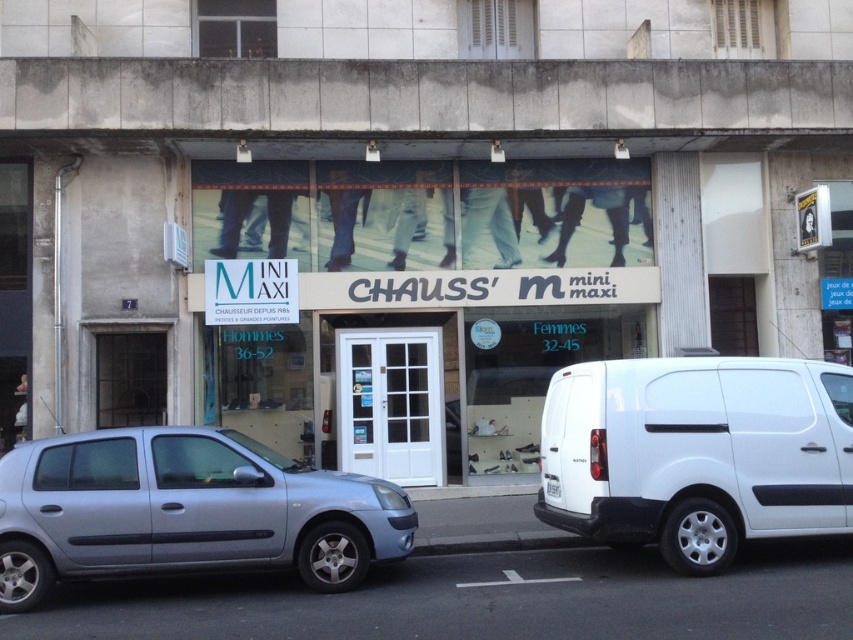
You are a pedestrian standing on the sidewalk in front of the MINI MAXI CHAUSSURE store. You see a white matte van at right and a satin silver car at lower left. Which vehicle is closer to you?

The white matte van at right is closer to you because it is further to the viewer than the satin silver car at lower left.

You are a delivery driver who needs to park your vehicle in the parking spot located behind the storefront. The parking spot is only 2 meters wide. You have a white matte van at right and a satin silver car at lower left. Which vehicle can fit into the parking spot without overlapping the storefront or other obstacles?

The satin silver car at lower left can fit into the parking spot since it is smaller in size compared to the white matte van at right, which is larger and may not fit within the 2 meters width.

You are a delivery driver who needs to park your white matte van at right near the MINI MAXI CHAUSSURE store. The parking spot has coordinates from 0.6 to 0.8 on the x and y axes. Can your van fit in the parking spot?

The white matte van at right is positioned at point (697,452), which falls within the parking spot coordinates of 0.6 to 0.8 on both axes. Therefore, the van can fit in the parking spot.